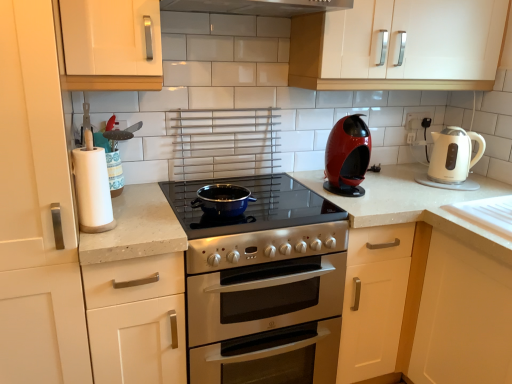
This screenshot has width=512, height=384. I want to click on vacant space that is to the left of white glossy electric kettle at right, placed as the 1th kitchen appliance when sorted from right to left, so click(x=405, y=185).